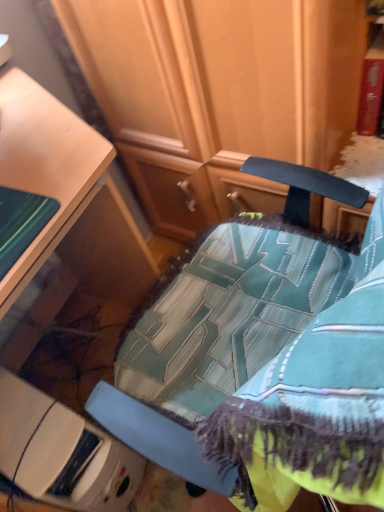
Find the location of a particular element. This screenshot has height=512, width=384. white plastic container at lower left is located at coordinates tap(61, 453).

What do you see at coordinates (61, 453) in the screenshot? I see `white plastic container at lower left` at bounding box center [61, 453].

Measure the distance between white plastic container at lower left and camera.

The distance of white plastic container at lower left from camera is 36.44 inches.

Describe the element at coordinates (260, 366) in the screenshot. I see `teal fabric chair at center` at that location.

You are a GUI agent. You are given a task and a screenshot of the screen. Output one action in this format:
    pyautogui.click(x=<x>, y=<y>)
    Task: Click on the teal fabric chair at center
    Image resolution: width=384 pixels, height=512 pixels.
    Given the screenshot: What is the action you would take?
    pyautogui.click(x=260, y=366)

Where is `white plastic container at lower left`? This screenshot has height=512, width=384. white plastic container at lower left is located at coordinates (61, 453).

Visually, is white plastic container at lower left positioned to the left or to the right of teal fabric chair at center?

Clearly, white plastic container at lower left is on the left of teal fabric chair at center in the image.

Does white plastic container at lower left come behind teal fabric chair at center?

Yes, it is behind teal fabric chair at center.

Considering the points (70, 415) and (225, 400), which point is behind, point (70, 415) or point (225, 400)?

The point (70, 415) is more distant.

From the image's perspective, is white plastic container at lower left beneath teal fabric chair at center?

Indeed, from the image's perspective, white plastic container at lower left is shown beneath teal fabric chair at center.

From a real-world perspective, which object stands above the other?

teal fabric chair at center, from a real-world perspective.

Looking at their sizes, would you say white plastic container at lower left is wider or thinner than teal fabric chair at center?

In the image, white plastic container at lower left appears to be more narrow than teal fabric chair at center.

Does white plastic container at lower left have a greater height compared to teal fabric chair at center?

In fact, white plastic container at lower left may be shorter than teal fabric chair at center.

Is white plastic container at lower left bigger than teal fabric chair at center?

Actually, white plastic container at lower left might be smaller than teal fabric chair at center.

Could teal fabric chair at center be considered to be inside white plastic container at lower left?

Definitely not — teal fabric chair at center is not inside white plastic container at lower left.

Is white plastic container at lower left far from teal fabric chair at center?

No, white plastic container at lower left is in close proximity to teal fabric chair at center.

Is white plastic container at lower left looking in the opposite direction of teal fabric chair at center?

No.

What's the angular difference between white plastic container at lower left and teal fabric chair at center's facing directions?

There is a 175-degree angle between the facing directions of white plastic container at lower left and teal fabric chair at center.

Locate an element on the screen. The width and height of the screenshot is (384, 512). furniture that is on the left side of teal fabric chair at center is located at coordinates (61, 453).

Between teal fabric chair at center and white plastic container at lower left, which one appears on the left side from the viewer's perspective?

From the viewer's perspective, white plastic container at lower left appears more on the left side.

Does teal fabric chair at center come behind white plastic container at lower left?

That is False.

Considering the points (211, 326) and (52, 469), which point is in front, point (211, 326) or point (52, 469)?

Point (211, 326)

From the image's perspective, who appears lower, teal fabric chair at center or white plastic container at lower left?

white plastic container at lower left, from the image's perspective.

From a real-world perspective, is teal fabric chair at center positioned over white plastic container at lower left based on gravity?

Correct, in the physical world, teal fabric chair at center is higher than white plastic container at lower left.

Can you confirm if teal fabric chair at center is thinner than white plastic container at lower left?

No.

From their relative heights in the image, would you say teal fabric chair at center is taller or shorter than white plastic container at lower left?

In the image, teal fabric chair at center appears to be taller than white plastic container at lower left.

Which of these two, teal fabric chair at center or white plastic container at lower left, is bigger?

teal fabric chair at center.

Is teal fabric chair at center positioned beyond the bounds of white plastic container at lower left?

Yes, teal fabric chair at center is outside of white plastic container at lower left.

Is teal fabric chair at center not near white plastic container at lower left?

Actually, teal fabric chair at center and white plastic container at lower left are a little close together.

Is white plastic container at lower left at the back of teal fabric chair at center?

teal fabric chair at center does not have its back to white plastic container at lower left.

Can you tell me how much teal fabric chair at center and white plastic container at lower left differ in facing direction?

175 degrees separate the facing orientations of teal fabric chair at center and white plastic container at lower left.

The height and width of the screenshot is (512, 384). In order to click on chair that is in front of the white plastic container at lower left in this screenshot , I will do `click(260, 366)`.

I want to click on furniture lying below the teal fabric chair at center (from the image's perspective), so click(x=61, y=453).

Find the location of a particular element. The width and height of the screenshot is (384, 512). chair above the white plastic container at lower left (from a real-world perspective) is located at coordinates (260, 366).